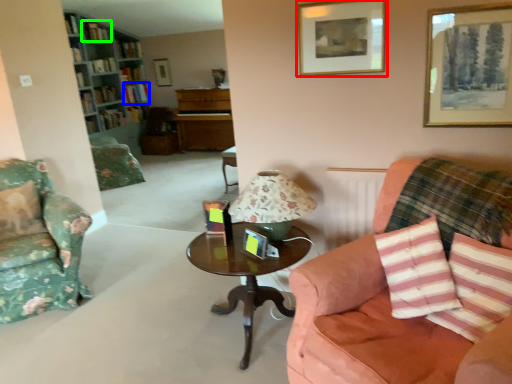
Question: Which object is positioned closest to picture frame (highlighted by a red box)? Select from book (highlighted by a blue box) and book (highlighted by a green box).

Choices:
 (A) book
 (B) book

Answer: (B)